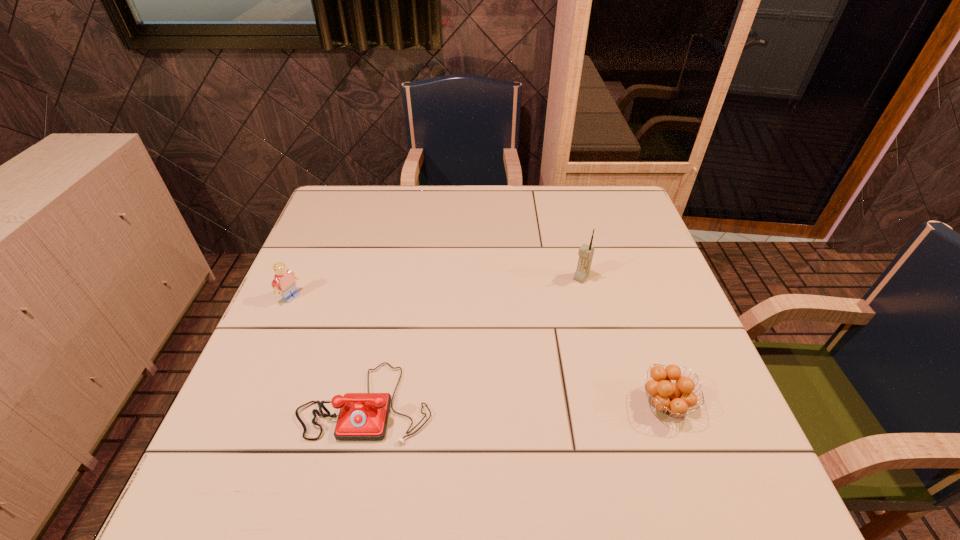
This screenshot has width=960, height=540. In order to click on the second object from left to right in this screenshot , I will do `click(363, 416)`.

Find the location of `orange fruit`. orange fruit is located at coordinates (673, 398).

At what (x,y) coordinates should I click in order to perform the action: click on cellular telephone. Please return your answer as a coordinate pair (x, y). The height and width of the screenshot is (540, 960). Looking at the image, I should click on (586, 252).

At what (x,y) coordinates should I click in order to perform the action: click on the tallest object. Please return your answer as a coordinate pair (x, y). This screenshot has width=960, height=540. Looking at the image, I should click on (586, 252).

The image size is (960, 540). I want to click on Lego, so click(284, 279).

This screenshot has width=960, height=540. I want to click on the second farthest object, so click(x=284, y=279).

The width and height of the screenshot is (960, 540). I want to click on vacant area situated 0.090m on the left of the orange fruit, so pos(594,404).

I want to click on free point located on the front of the farthest object, where the keypad is located, so click(518, 356).

The height and width of the screenshot is (540, 960). I want to click on free space located 0.230m on the front of the farthest object, where the keypad is located, so click(x=532, y=339).

The width and height of the screenshot is (960, 540). I want to click on vacant point located 0.140m on the front of the farthest object, where the keypad is located, so click(551, 315).